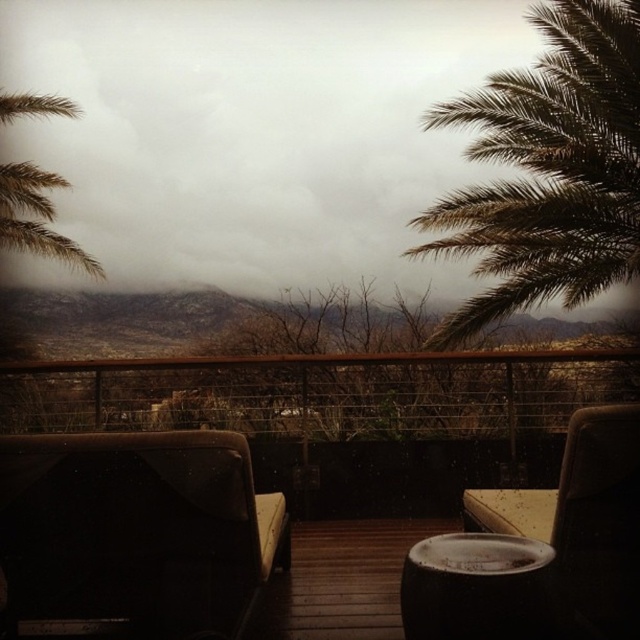
Question: Which point is closer to the camera?

Choices:
 (A) green leafy palm tree at left
 (B) dark brown leather armchair at lower left
 (C) smooth dark brown stool at center
 (D) green leafy palm tree at upper right

Answer: (C)

Question: Among these points, which one is farthest from the camera?

Choices:
 (A) (536, 301)
 (B) (371, 588)
 (C) (540, 577)

Answer: (A)

Question: Is green leafy palm tree at upper right above green leafy palm tree at left?

Choices:
 (A) yes
 (B) no

Answer: (A)

Question: Can you confirm if cloudy gray sky at upper center is wider than smooth dark brown stool at center?

Choices:
 (A) yes
 (B) no

Answer: (A)

Question: Is green leafy palm tree at upper right smaller than smooth dark brown stool at center?

Choices:
 (A) no
 (B) yes

Answer: (A)

Question: Which object is the farthest from the leather armchair at right?

Choices:
 (A) wooden deck at center
 (B) smooth dark brown stool at center

Answer: (A)